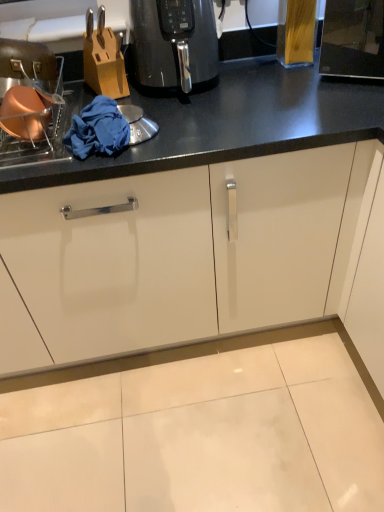
Question: Choose the correct answer: Is matte copper pot at left inside black glossy air fryer at center or outside it?

Choices:
 (A) outside
 (B) inside

Answer: (A)

Question: Considering the positions of matte copper pot at left and black glossy air fryer at center in the image, is matte copper pot at left wider or thinner than black glossy air fryer at center?

Choices:
 (A) thin
 (B) wide

Answer: (B)

Question: Which of these objects is positioned farthest from the blue fabric at left?

Choices:
 (A) matte copper pot at left
 (B) black glossy air fryer at center

Answer: (B)

Question: Based on their relative distances, which object is farther from the black glossy air fryer at center?

Choices:
 (A) matte copper pot at left
 (B) blue fabric at left

Answer: (A)